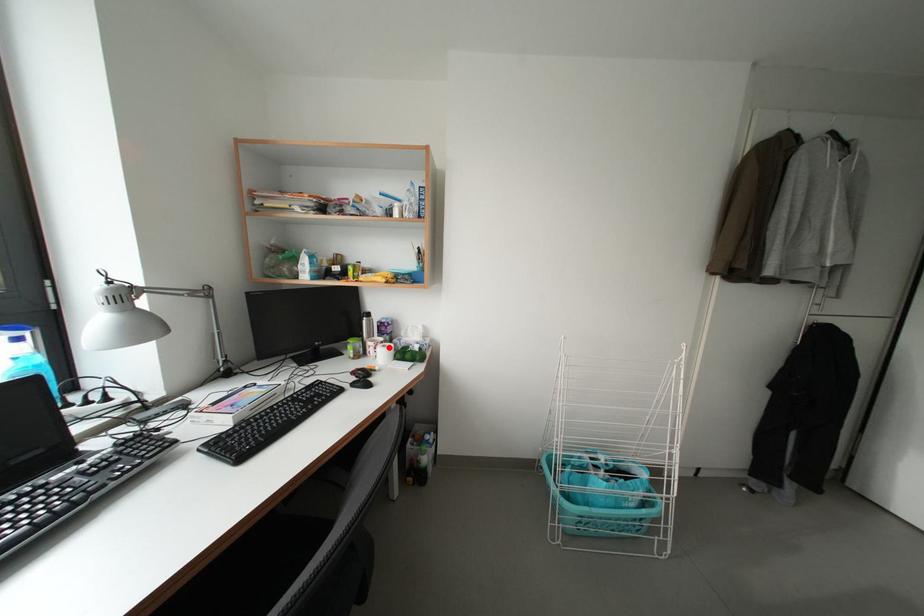
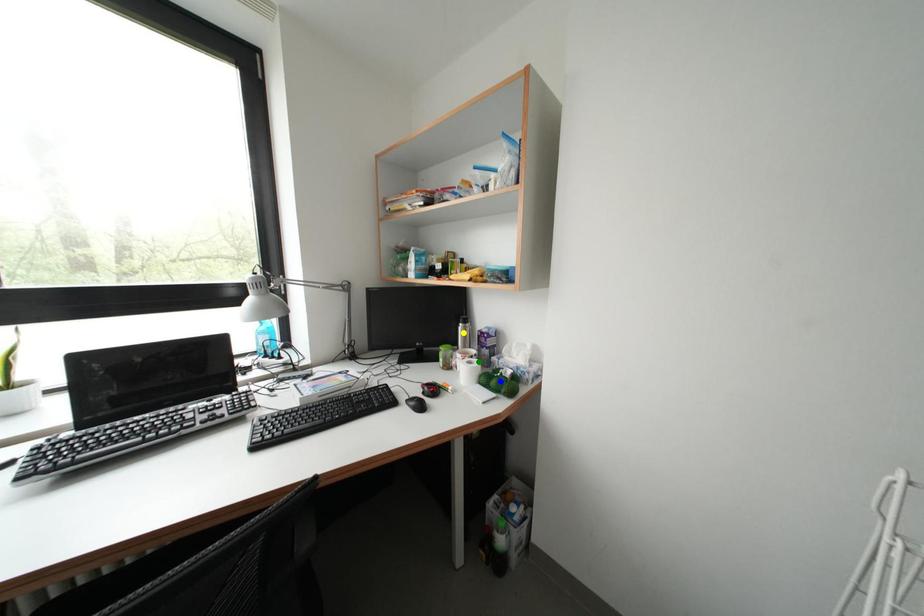
Question: I am providing you with two images of the same scene from different viewpoints. A red point is marked on the first image. You are given multiple points on the second image. In image 2, which mark is for the same physical point as the one in image 1?

Choices:
 (A) green point
 (B) blue point
 (C) yellow point

Answer: (A)